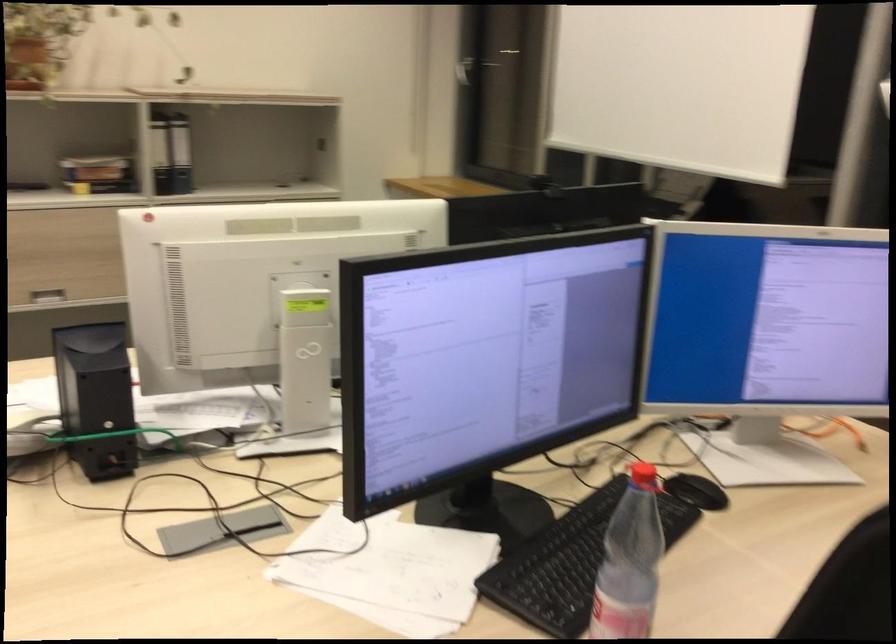
This screenshot has width=896, height=644. Describe the element at coordinates (39, 41) in the screenshot. I see `the terracotta plant pot` at that location.